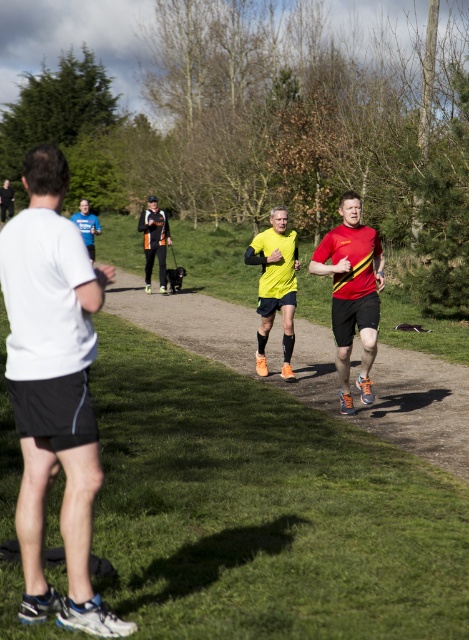
You are a photographer positioned at the starting line of a race. You need to capture a photo that includes both the white matte shirt at left and the yellow matte running shoe at center. Which object should you focus on first to ensure both are in the frame?

You should focus on the white matte shirt at left first because it is taller than the yellow matte running shoe at center, ensuring it will be visible and properly framed in the photo.